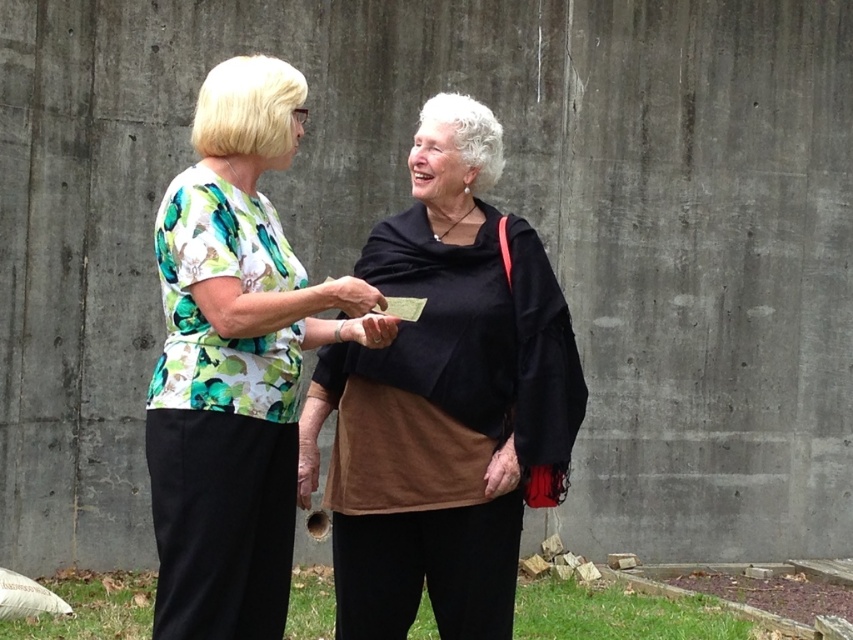
Question: Which of the following is the closest to the observer?

Choices:
 (A) (469, 186)
 (B) (389, 316)
 (C) (386, 324)

Answer: (C)

Question: Considering the relative positions of printed fabric blouse at center and smooth skin hand at center in the image provided, where is printed fabric blouse at center located with respect to smooth skin hand at center?

Choices:
 (A) left
 (B) right

Answer: (A)

Question: Which of these objects is positioned farthest from the black suede shawl at center?

Choices:
 (A) smooth skin hand at center
 (B) matte black hand at center

Answer: (A)

Question: Can you confirm if black suede shawl at center is positioned to the right of matte black hand at center?

Choices:
 (A) yes
 (B) no

Answer: (A)

Question: Among these points, which one is farthest from the camera?

Choices:
 (A) (242, 256)
 (B) (372, 324)
 (C) (386, 307)
 (D) (467, 474)

Answer: (D)

Question: Is black suede shawl at center thinner than smooth skin hand at center?

Choices:
 (A) yes
 (B) no

Answer: (B)